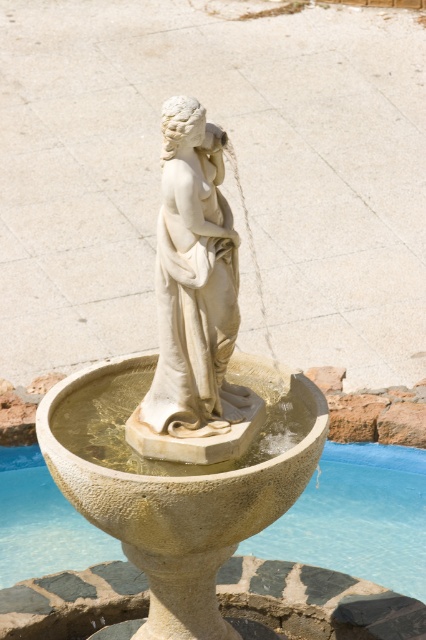
Can you confirm if white stone statue at center is positioned above clear water at fountain center?

Indeed, white stone statue at center is positioned over clear water at fountain center.

Is point (273, 500) closer to viewer compared to point (314, 538)?

Yes, it is in front of point (314, 538).

At what (x,y) coordinates should I click in order to perform the action: click on white stone statue at center. Please return your answer as a coordinate pair (x, y). Looking at the image, I should click on (184, 408).

Does white stone statue at center have a smaller size compared to white marble statue at center?

No.

Is white stone statue at center to the right of white marble statue at center from the viewer's perspective?

No, white stone statue at center is not to the right of white marble statue at center.

Is point (131, 428) positioned before point (201, 344)?

No, it is behind (201, 344).

Find the location of a particular element. This screenshot has width=426, height=640. white stone statue at center is located at coordinates (184, 408).

Can you confirm if white marble statue at center is thinner than clear water at fountain center?

Yes.

Which is behind, point (178, 124) or point (408, 528)?

Positioned behind is point (408, 528).

Locate an element on the screen. The height and width of the screenshot is (640, 426). white marble statue at center is located at coordinates (192, 301).